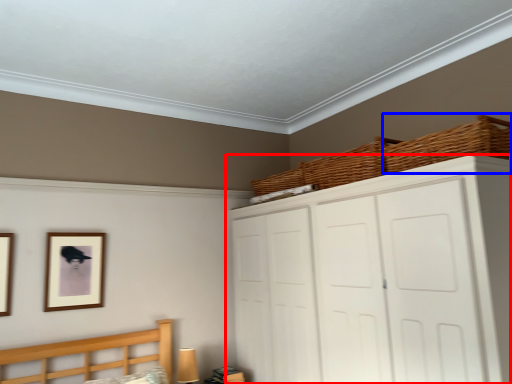
Question: Which object is further to the camera taking this photo, cupboard (highlighted by a red box) or basket (highlighted by a blue box)?

Choices:
 (A) cupboard
 (B) basket

Answer: (B)